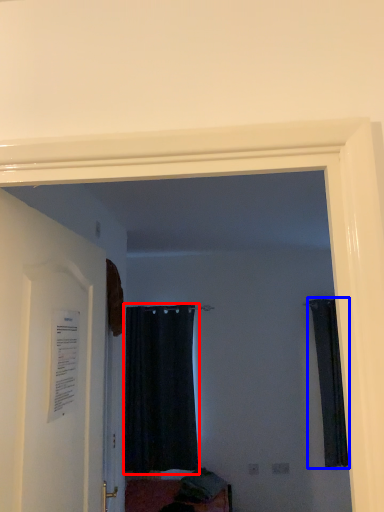
Question: Which object appears closest to the camera in this image, curtain (highlighted by a red box) or curtain (highlighted by a blue box)?

Choices:
 (A) curtain
 (B) curtain

Answer: (B)